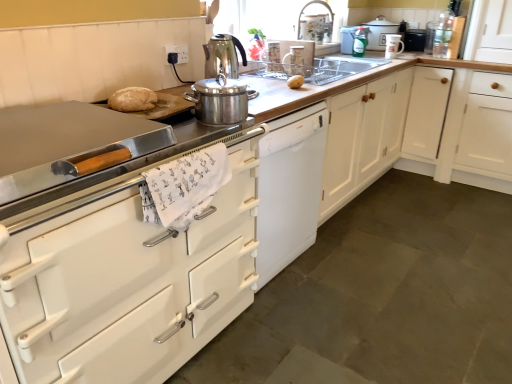
The height and width of the screenshot is (384, 512). In order to click on vacant area that lies between clear glass sink at center and yellow matte potato at center in this screenshot , I will do `click(279, 77)`.